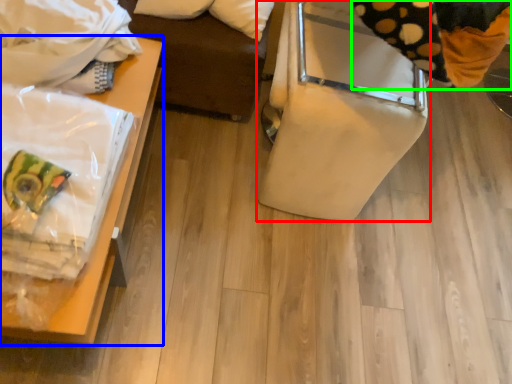
Question: Estimate the real-world distances between objects in this image. Which object is farther from furniture (highlighted by a red box), furniture (highlighted by a blue box) or material (highlighted by a green box)?

Choices:
 (A) furniture
 (B) material

Answer: (A)